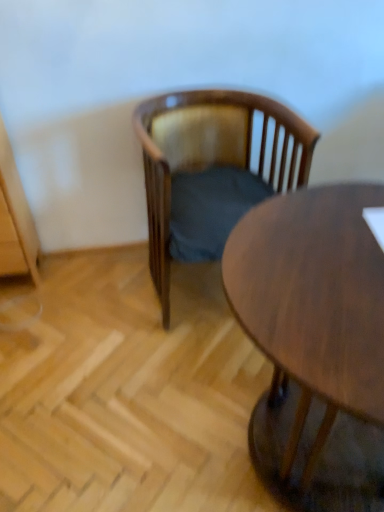
Find the location of a particular element. vacant area on top of wooden round table at center (from a real-world perspective) is located at coordinates (319, 262).